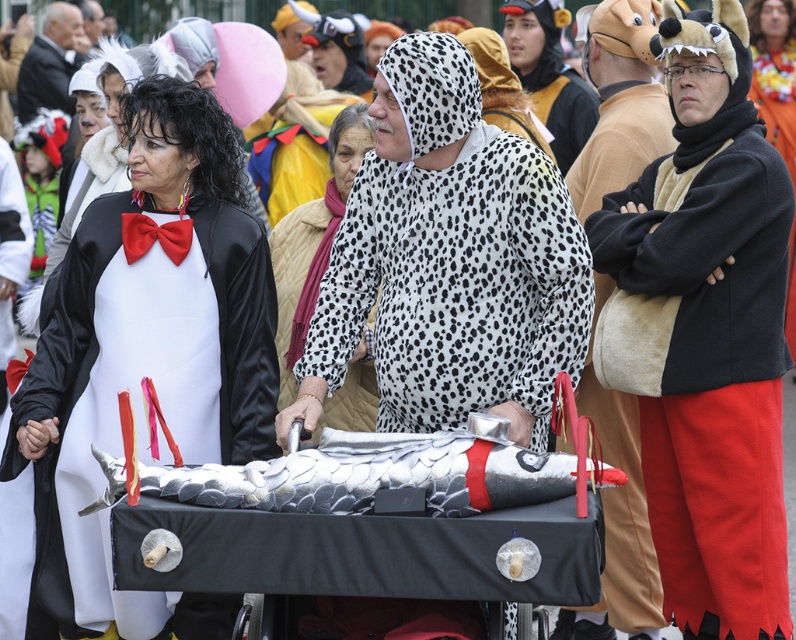
You are a photographer at the event and want to capture the velvet brown robe at right and the white quilted vest at center in the same frame. Which clothing item is closer to the camera?

The velvet brown robe at right is positioned under the white quilted vest at center, which means it is closer to the camera.

From the picture: You are standing in the middle of the scene and want to locate the velvet brown robe at right. According to the coordinates given, in which direction should you look to find it?

The velvet brown robe at right is located at coordinates point [621,499], so you should look to the lower right direction to find it.